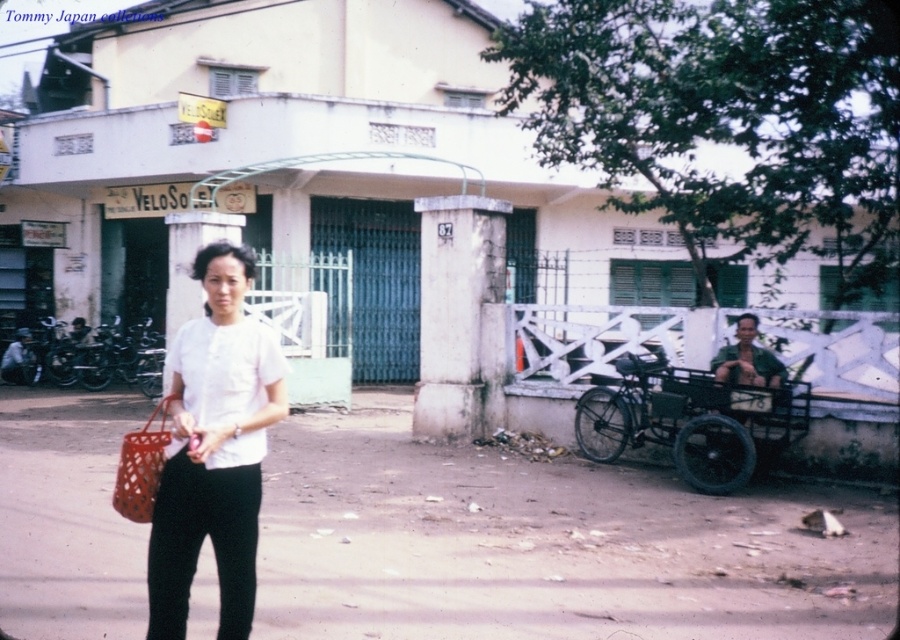
Is brown dirt pavement at center positioned before white matte shirt at center?

No, brown dirt pavement at center is behind white matte shirt at center.

What do you see at coordinates (545, 547) in the screenshot?
I see `brown dirt pavement at center` at bounding box center [545, 547].

Identify the location of brown dirt pavement at center. (545, 547).

Can you confirm if brown dirt pavement at center is positioned below black metal cart at right?

Correct, brown dirt pavement at center is located below black metal cart at right.

Does brown dirt pavement at center have a larger size compared to black metal cart at right?

Yes, brown dirt pavement at center is bigger than black metal cart at right.

Between point (84, 474) and point (699, 385), which one is positioned in front?

Point (699, 385) is more forward.

This screenshot has height=640, width=900. Find the location of `brown dirt pavement at center`. brown dirt pavement at center is located at coordinates (545, 547).

Find the location of a particular element. This screenshot has width=900, height=640. white matte shirt at center is located at coordinates (214, 449).

Who is positioned more to the left, white matte shirt at center or black metal cart at right?

From the viewer's perspective, white matte shirt at center appears more on the left side.

Where is `white matte shirt at center`? Image resolution: width=900 pixels, height=640 pixels. white matte shirt at center is located at coordinates (214, 449).